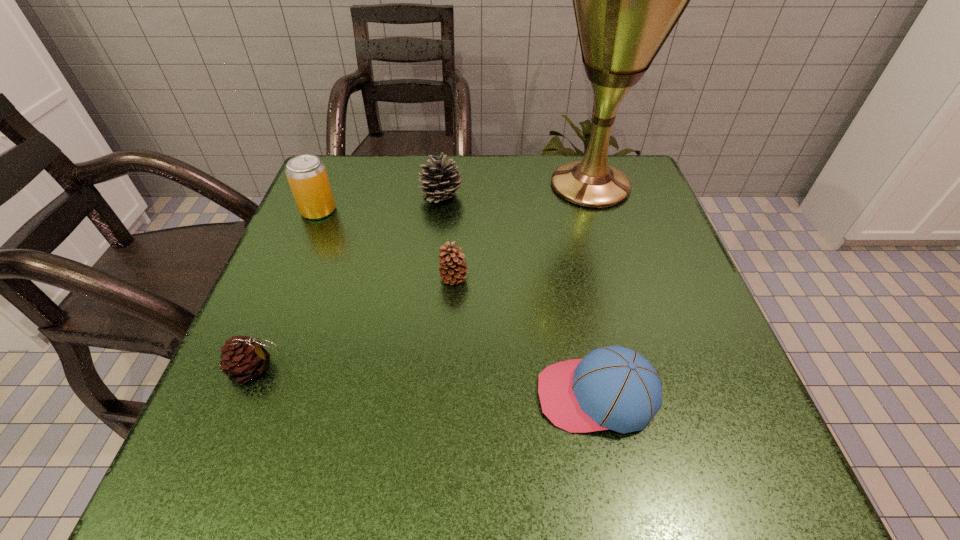
Where is `vacant space located on the left of the farthest pinecone`? Image resolution: width=960 pixels, height=540 pixels. vacant space located on the left of the farthest pinecone is located at coordinates (348, 196).

In order to click on vacant space located on the left of the fourth farthest object in this screenshot , I will do `click(300, 278)`.

Find the location of `free region located 0.270m on the front-facing side of the baseball cap`. free region located 0.270m on the front-facing side of the baseball cap is located at coordinates (363, 395).

In order to click on vacant point located 0.380m on the front-facing side of the baseball cap in this screenshot , I will do `click(291, 395)`.

Image resolution: width=960 pixels, height=540 pixels. What are the coordinates of `vacant region located on the front-facing side of the baseball cap` in the screenshot? It's located at (460, 395).

Find the location of a particular element. vacant space positioned 0.230m with a leaf charm attached to the leftmost pinecone is located at coordinates (423, 368).

This screenshot has height=540, width=960. What are the coordinates of `trophy cup situated at the far edge` in the screenshot? It's located at (627, 0).

Where is `pop (soda) positioned at the far edge`? pop (soda) positioned at the far edge is located at coordinates (307, 176).

This screenshot has height=540, width=960. I want to click on pinecone located in the far edge section of the desktop, so click(439, 181).

Where is `object that is at the near edge`? Image resolution: width=960 pixels, height=540 pixels. object that is at the near edge is located at coordinates (613, 387).